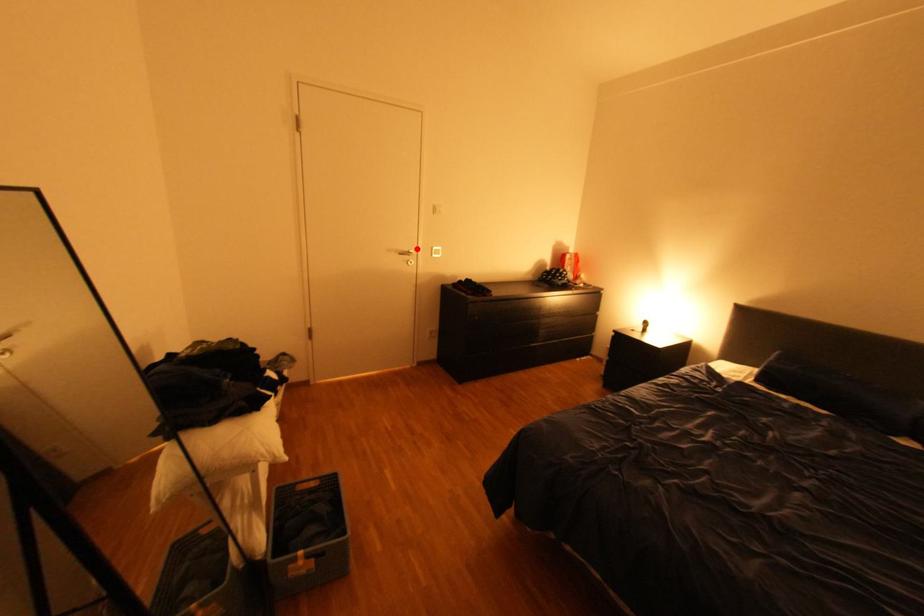
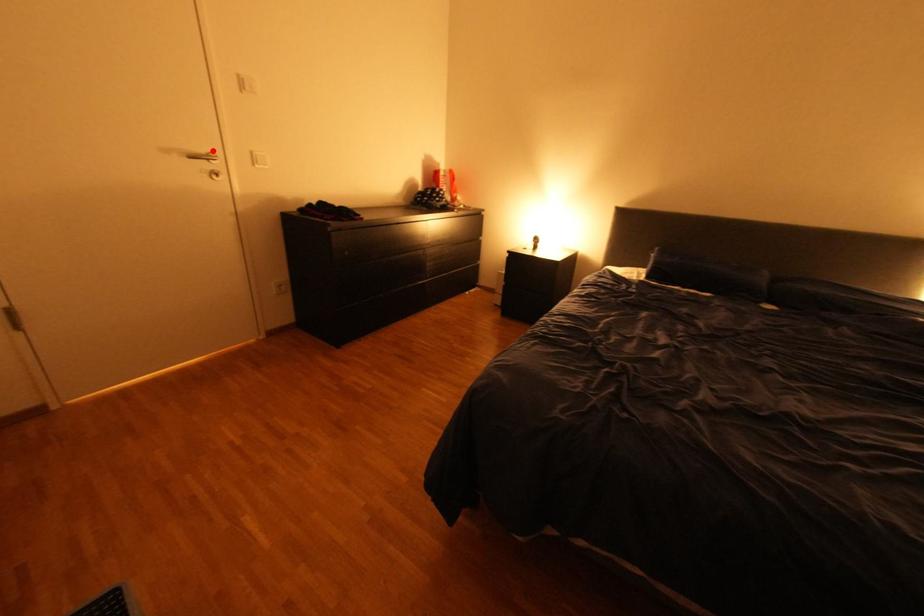
I am providing you with two images of the same scene from different viewpoints. A red point is marked on the first image and another point is marked on the second image. Is the marked point in image1 the same physical position as the marked point in image2?

Yes